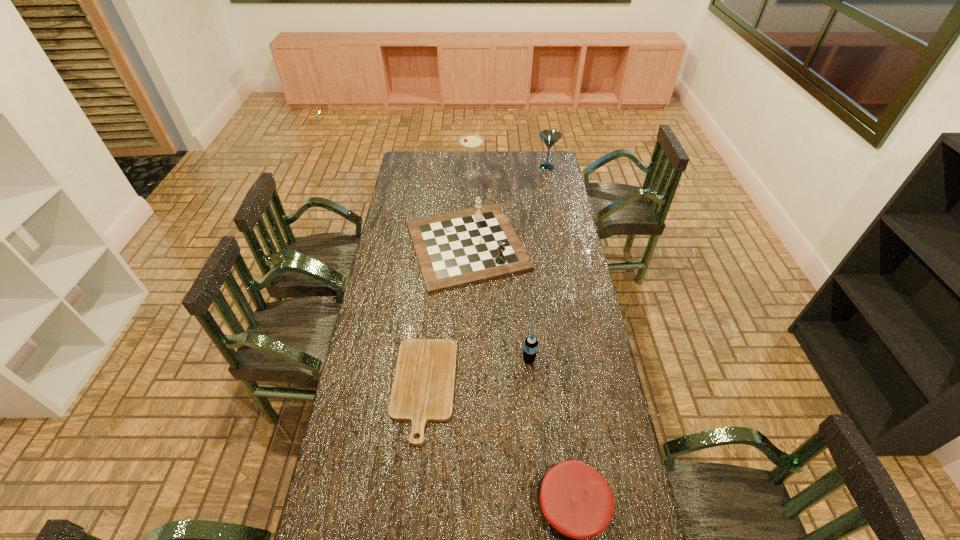
Identify the location of gameboard located in the left edge section of the desktop. Image resolution: width=960 pixels, height=540 pixels. (454, 249).

At what (x,y) coordinates should I click in order to perform the action: click on chopping board that is at the left edge. Please return your answer as a coordinate pair (x, y). Looking at the image, I should click on (423, 388).

Where is `object located in the right edge section of the desktop`? The height and width of the screenshot is (540, 960). object located in the right edge section of the desktop is located at coordinates (549, 137).

The height and width of the screenshot is (540, 960). Find the location of `object situated at the far right corner`. object situated at the far right corner is located at coordinates (549, 137).

Identify the location of vacant position at the far edge of the desktop. (500, 169).

Locate an element on the screen. Image resolution: width=960 pixels, height=540 pixels. free space at the left edge of the desktop is located at coordinates (410, 186).

This screenshot has height=540, width=960. In the image, there is a desktop. Identify the location of blank space at the right edge. (551, 248).

Locate an element on the screen. The width and height of the screenshot is (960, 540). vacant space at the far left corner of the desktop is located at coordinates (419, 157).

This screenshot has height=540, width=960. I want to click on vacant area that lies between the shortest object and the soda bottle, so click(476, 374).

You are a GUI agent. You are given a task and a screenshot of the screen. Output one action in this format:
    pyautogui.click(x=<x>, y=<y>)
    Task: Click on the vacant area between the soda bottle and the shortest object
    This screenshot has width=960, height=540.
    Given the screenshot: What is the action you would take?
    (476, 374)